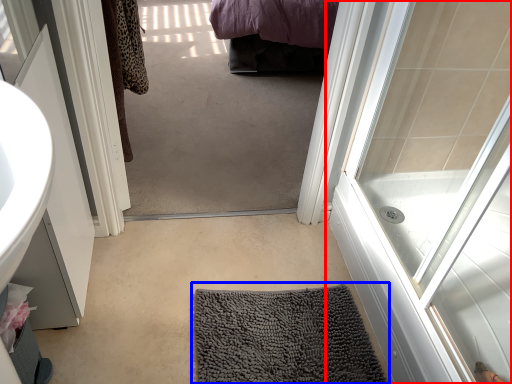
Question: Which point is closer to the camera, door (highlighted by a red box) or bath mat (highlighted by a blue box)?

Choices:
 (A) door
 (B) bath mat

Answer: (A)